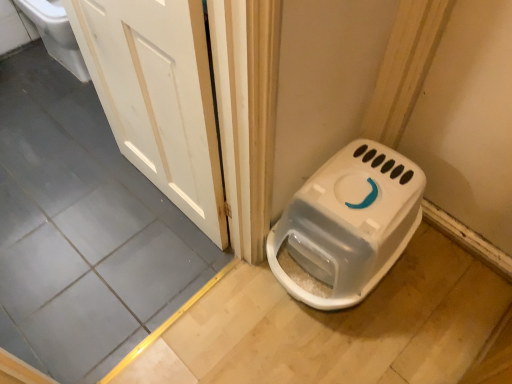
Locate an element on the screen. vacant area that is in front of white wood door at upper left is located at coordinates (139, 258).